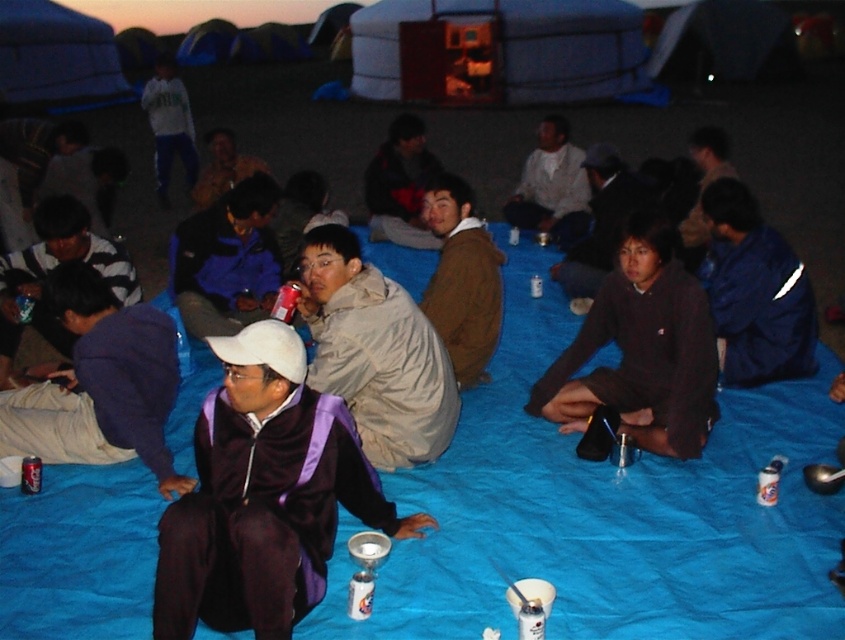
Image resolution: width=845 pixels, height=640 pixels. I want to click on purple fleece jacket at lower left, so click(99, 384).

Does dark blue jacket at center have a lesser width compared to metallic can at center?

Yes.

Which is above, dark blue jacket at center or metallic can at center?

dark blue jacket at center is above.

The image size is (845, 640). What are the coordinates of `dark blue jacket at center` in the screenshot? It's located at (702, 188).

Does brown fuzzy jacket at center appear under camouflage jacket at center?

Indeed, brown fuzzy jacket at center is positioned under camouflage jacket at center.

Between brown fuzzy jacket at center and camouflage jacket at center, which one has less height?

camouflage jacket at center

Which is in front, point (439, 259) or point (225, 160)?

Point (439, 259) is more forward.

At what (x,y) coordinates should I click in order to perform the action: click on brown fuzzy jacket at center. Please return your answer as a coordinate pair (x, y). The height and width of the screenshot is (640, 845). Looking at the image, I should click on (462, 280).